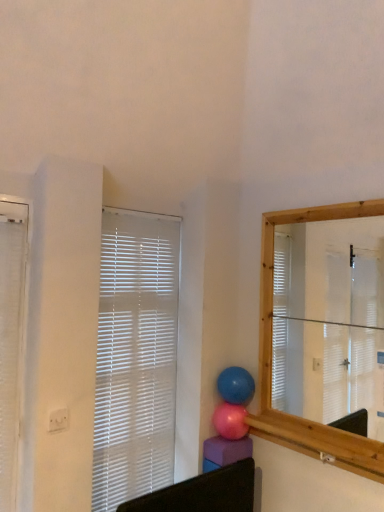
Question: Is glossy blue balloon at center, the first balloon positioned from the top, in front of or behind pink rubber balloon at center, the second balloon positioned from the top, in the image?

Choices:
 (A) front
 (B) behind

Answer: (B)

Question: Visually, is glossy blue balloon at center, which ranks as the 2th balloon in bottom-to-top order, positioned to the left or to the right of pink rubber balloon at center, the 1th balloon from the bottom?

Choices:
 (A) left
 (B) right

Answer: (B)

Question: Estimate the real-world distances between objects in this image. Which object is farther from the white plastic blinds at upper left, which ranks as the first window blind in right-to-left order?

Choices:
 (A) glossy blue balloon at center, which ranks as the 2th balloon in bottom-to-top order
 (B) white textured window blind at left, positioned as the first window blind in left-to-right order
 (C) pink rubber balloon at center, the 1th balloon from the bottom

Answer: (B)

Question: Which object is the farthest from the pink rubber balloon at center, the second balloon positioned from the top?

Choices:
 (A) white textured window blind at left, arranged as the 1th window blind when viewed from the front
 (B) white plastic blinds at upper left, marked as the 2th window blind in a front-to-back arrangement
 (C) glossy blue balloon at center, the first balloon positioned from the top

Answer: (A)